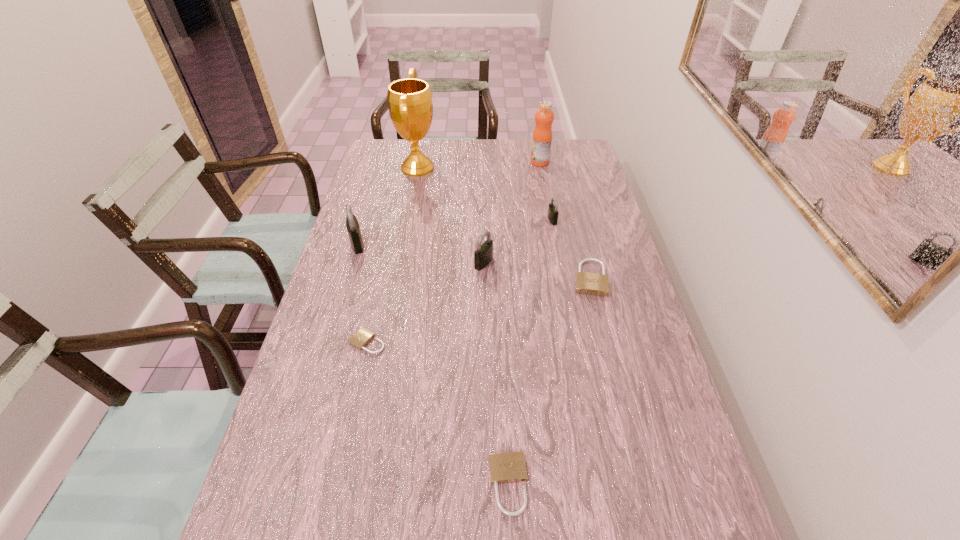
You are a GUI agent. You are given a task and a screenshot of the screen. Output one action in this format:
    pyautogui.click(x=<x>, y=<y>)
    Task: Click on the free space located on the back of the rightmost beige padlock
    The image size is (960, 540).
    Given the screenshot: What is the action you would take?
    pyautogui.click(x=567, y=190)

Find the location of a particular element. The width and height of the screenshot is (960, 540). vacant space located 0.390m on the back of the second shortest object is located at coordinates (501, 315).

Where is `vacant space situated on the right of the second nearest padlock`? The image size is (960, 540). vacant space situated on the right of the second nearest padlock is located at coordinates (455, 342).

Identify the location of award present at the far edge. Image resolution: width=960 pixels, height=540 pixels. (410, 105).

At what (x,y) coordinates should I click in order to perform the action: click on fruit juice present at the far edge. Please return your answer as a coordinate pair (x, y). The image size is (960, 540). Looking at the image, I should click on (542, 136).

The width and height of the screenshot is (960, 540). In order to click on award situated at the left edge in this screenshot , I will do `click(410, 105)`.

Where is `object at the right edge`? This screenshot has width=960, height=540. object at the right edge is located at coordinates [x=588, y=283].

At what (x,y) coordinates should I click in order to perform the action: click on object that is at the far left corner. Please return your answer as a coordinate pair (x, y). The width and height of the screenshot is (960, 540). Looking at the image, I should click on (410, 105).

In the image, there is a desktop. At what (x,y) coordinates should I click in order to perform the action: click on blank space at the left edge. Please return your answer as a coordinate pair (x, y). This screenshot has height=540, width=960. Looking at the image, I should click on (303, 523).

This screenshot has height=540, width=960. In the image, there is a desktop. Find the location of `vacant space at the right edge`. vacant space at the right edge is located at coordinates (678, 488).